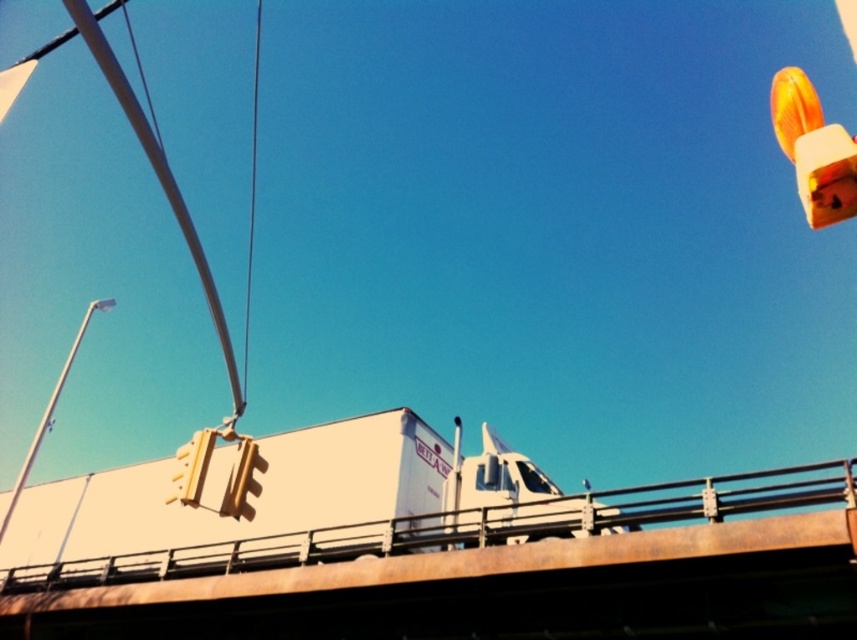
Which is behind, point (195, 438) or point (28, 470)?

The point (28, 470) is behind.

Can you confirm if yellow matte traffic light at left is shorter than white metal pole at left?

Yes, yellow matte traffic light at left is shorter than white metal pole at left.

The height and width of the screenshot is (640, 857). I want to click on yellow matte traffic light at left, so click(226, 476).

Between point (806, 170) and point (247, 465), which one is positioned behind?

Positioned behind is point (247, 465).

Who is positioned more to the right, orange glossy traffic light at upper right or yellow matte traffic light at left?

orange glossy traffic light at upper right is more to the right.

This screenshot has width=857, height=640. Describe the element at coordinates (813, 148) in the screenshot. I see `orange glossy traffic light at upper right` at that location.

Where is `orange glossy traffic light at upper right`? The height and width of the screenshot is (640, 857). orange glossy traffic light at upper right is located at coordinates (813, 148).

Does point (258, 461) lie behind point (253, 228)?

That is False.

Measure the distance between point (186,445) and camera.

Point (186,445) and camera are 5.63 meters apart from each other.

Who is more distant from viewer, (202,442) or (256,96)?

The point (256,96) is more distant.

Where is `yellow matte traffic light at left`? yellow matte traffic light at left is located at coordinates pos(226,476).